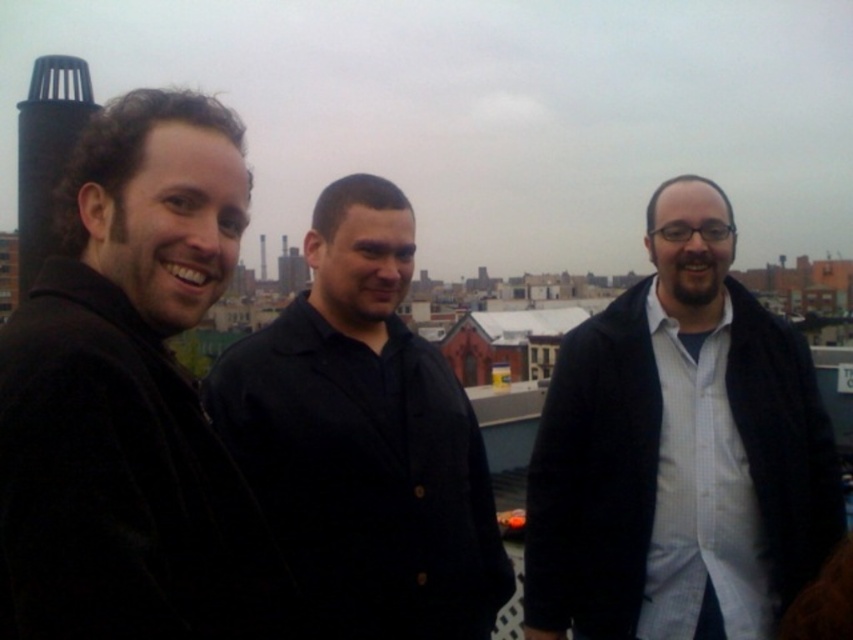
Consider the image. You are a fashion designer analyzing the image. You need to identify the exact location of the black velvet jacket at left in the image coordinate system. What is its position?

The black velvet jacket at left is located at point (x=131, y=396) in the image coordinate system.

You are a photographer trying to capture a group photo of the black velvet jacket at left and the black matte shirt at center. Since you want to ensure both subjects are in focus, you need to know which one is taller. Which object is taller?

The black velvet jacket at left is much taller as black matte shirt at center, so the photographer should adjust the camera angle to account for the height difference between the black velvet jacket at left and the black matte shirt at center.

You are standing at the point labeled as point (621, 492) in the image. You want to take a photo of the three people in the scene. Can you see them clearly from your current position?

The point labeled as point (621, 492) is 70.75 meters away from the viewer. Since the three people are part of the scene described in the image, which includes an urban skyline and the individuals standing outdoors, the distance of 70.75 meters may make it difficult to see them clearly without zooming or moving closer. Therefore, from your current position at point (621, 492), you might not be able to see the three people clearly.